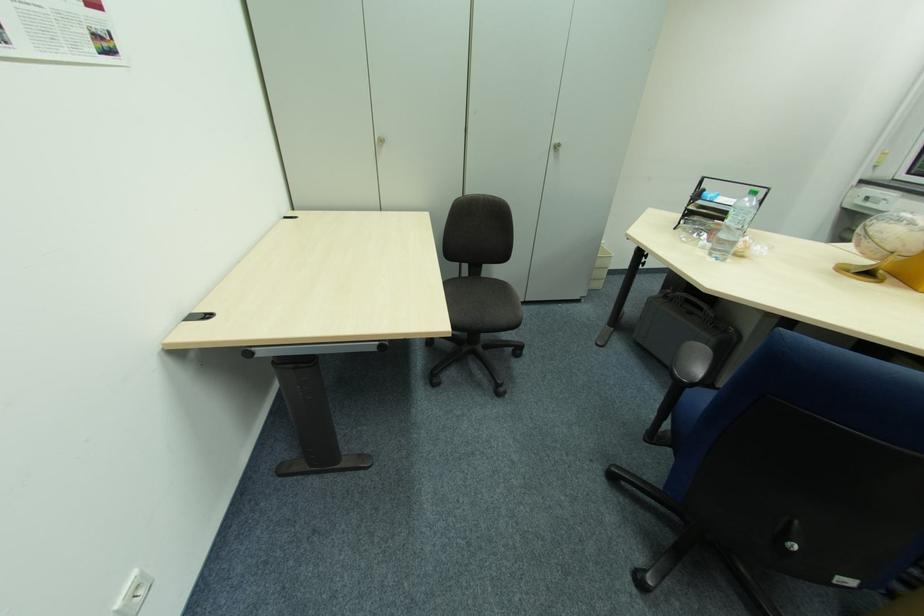
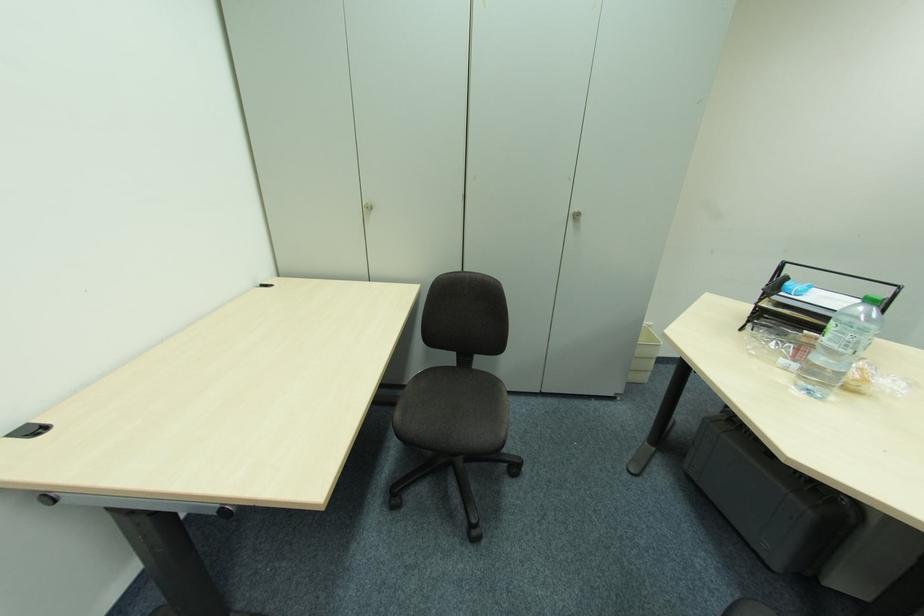
Find the pixel in the second image that matches the point at 485,278 in the first image.

(477, 371)